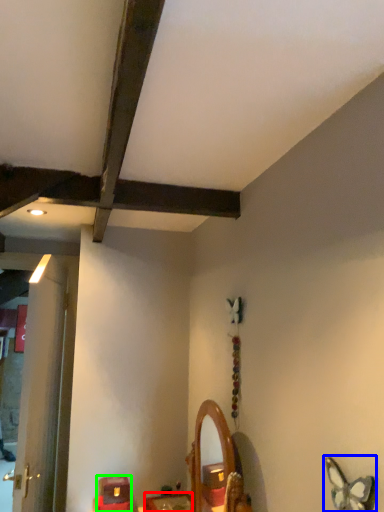
Question: Based on their relative distances, which object is farther from furniture (highlighted by a red box)? Choose from butterfly (highlighted by a blue box) and furniture (highlighted by a green box).

Choices:
 (A) butterfly
 (B) furniture

Answer: (A)